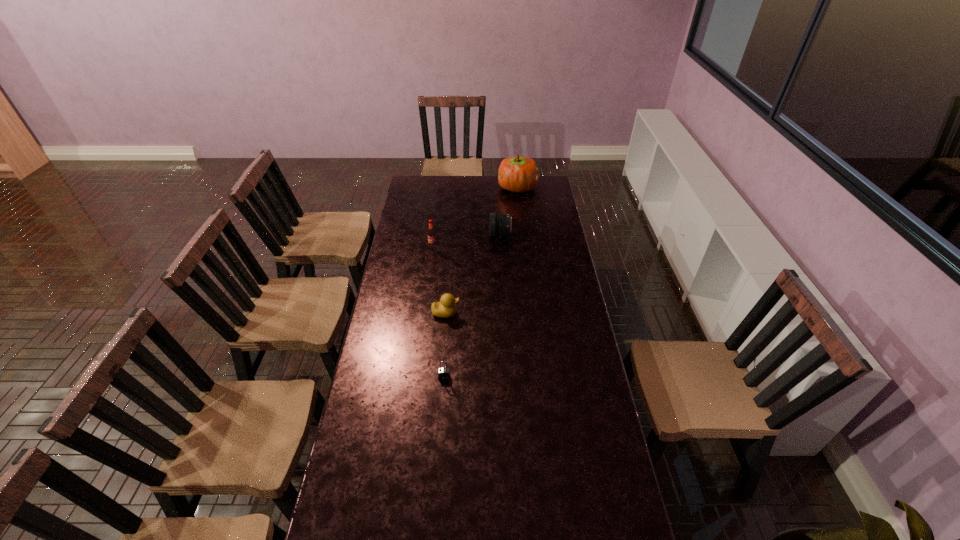
At what (x,y) coordinates should I click in order to perform the action: click on free region located 0.160m on the right of the root beer. Please return your answer as a coordinate pair (x, y). Looking at the image, I should click on (469, 247).

Identify the location of vacant space located 0.330m at the front element of the telephoto lens. (425, 235).

The image size is (960, 540). Find the location of `blank space located 0.240m at the front element of the telephoto lens`. blank space located 0.240m at the front element of the telephoto lens is located at coordinates click(443, 235).

You are a GUI agent. You are given a task and a screenshot of the screen. Output one action in this format:
    pyautogui.click(x=<x>, y=<y>)
    Task: Click on the vacant space located at the front element of the telephoto lens
    The height and width of the screenshot is (540, 960).
    Given the screenshot: What is the action you would take?
    pyautogui.click(x=439, y=235)

Where is `vacant space located on the face of the fourth farthest object`? vacant space located on the face of the fourth farthest object is located at coordinates click(x=547, y=313).

Find the location of a particular element. vacant area situated on the shackle of the nearest object is located at coordinates click(439, 445).

Identify the location of object that is at the far edge. (520, 174).

You are a GUI agent. You are given a task and a screenshot of the screen. Output one action in this format:
    pyautogui.click(x=<x>, y=<y>)
    Task: Click on the object positioned at the right edge
    The image size is (960, 540).
    Given the screenshot: What is the action you would take?
    pyautogui.click(x=520, y=174)

The width and height of the screenshot is (960, 540). Identify the location of object that is at the far right corner. 520,174.

Find the location of a particular element. The image size is (960, 540). vacant space at the left edge is located at coordinates (390, 460).